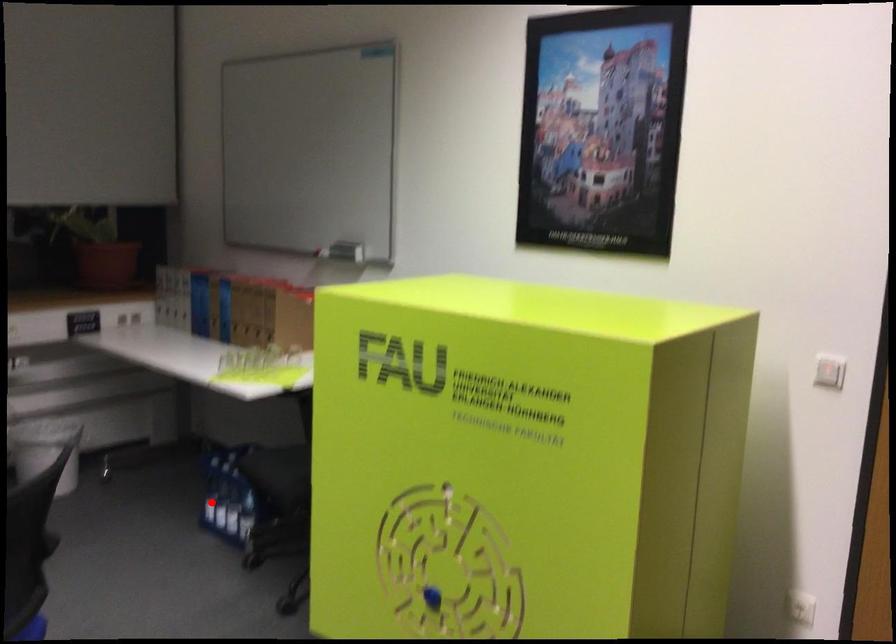
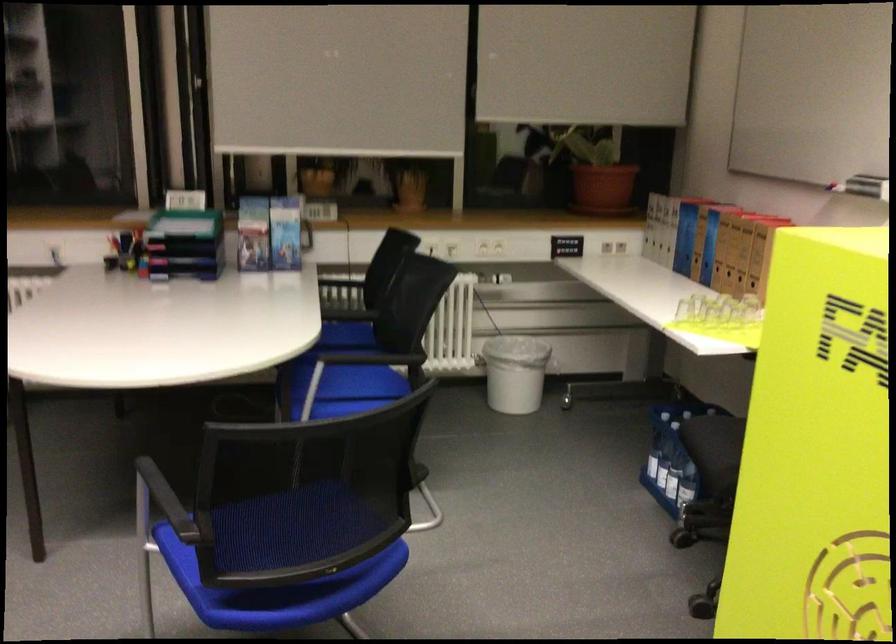
The point at the highlighted location is marked in the first image. Where is the corresponding point in the second image?

(650, 458)